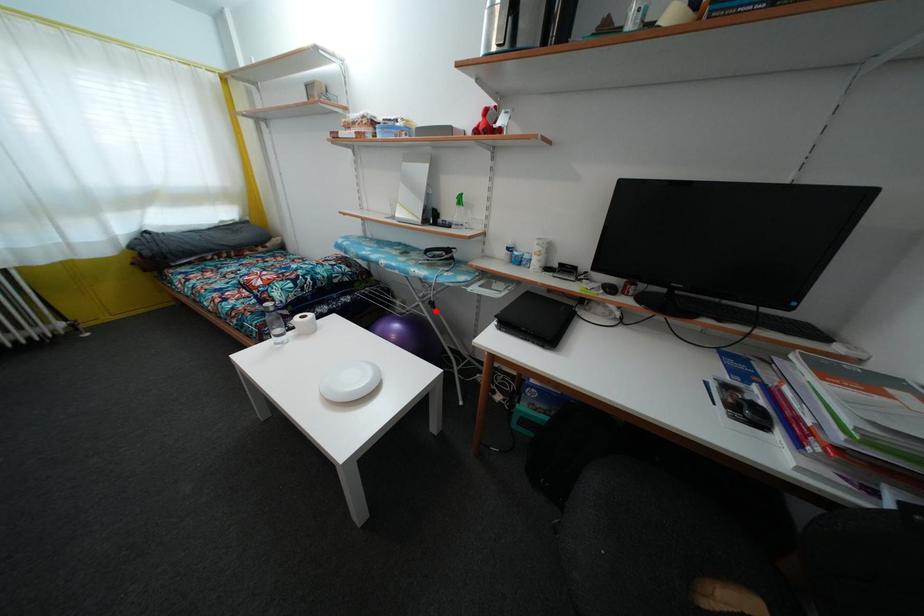
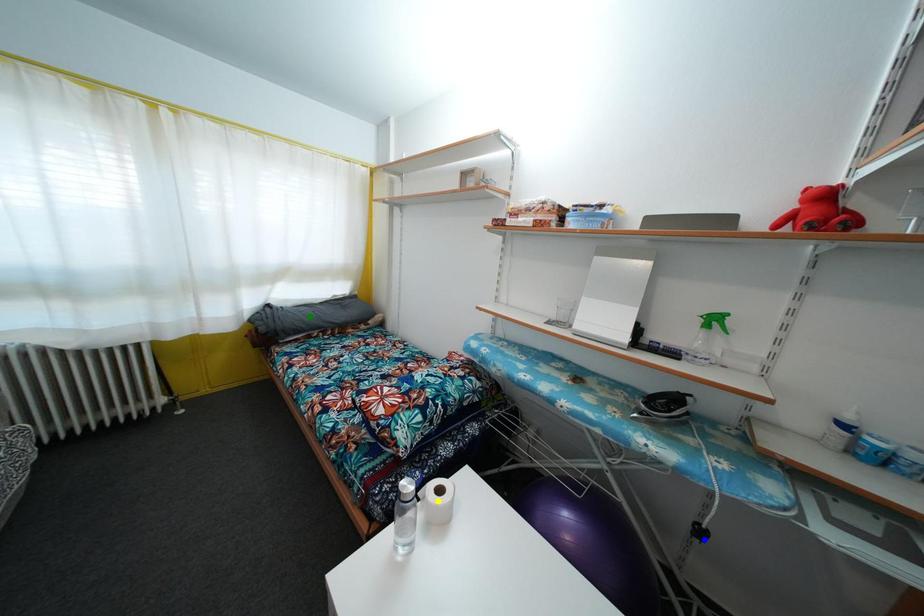
Question: I am providing you with two images of the same scene from different viewpoints. A red point is marked on the first image. You are given multiple points on the second image. Can you choose the point in image 2 that corresponds to the point in image 1?

Choices:
 (A) blue point
 (B) yellow point
 (C) green point

Answer: (A)